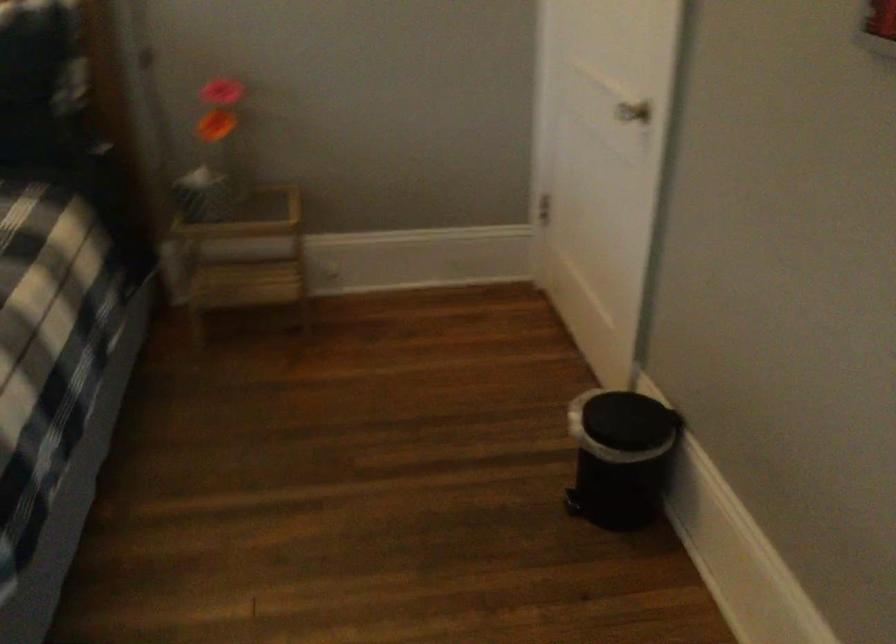
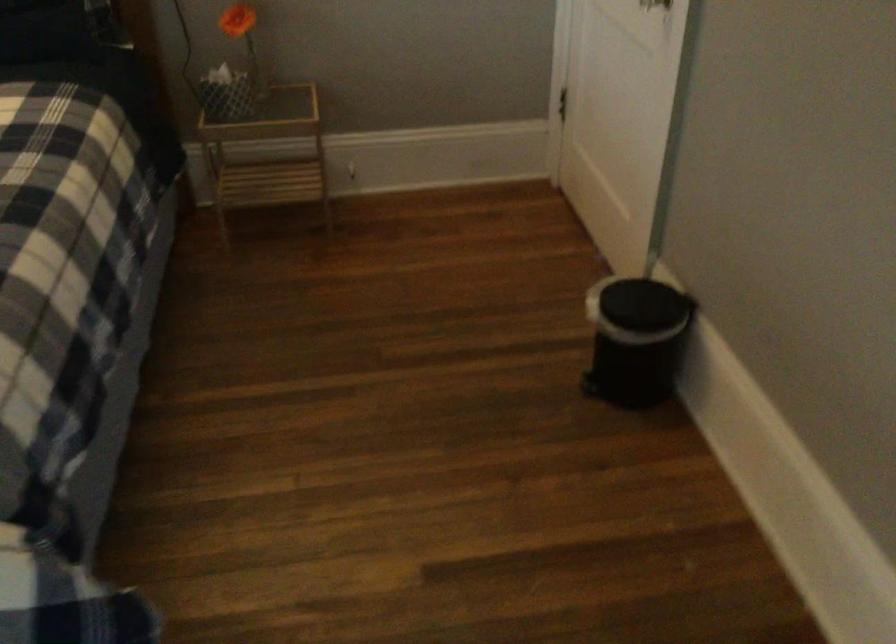
Question: Which direction would the cameraman need to move to produce the second image? Reply with the corresponding letter.

Choices:
 (A) Left
 (B) Right
 (C) Forward
 (D) Backward

Answer: (D)